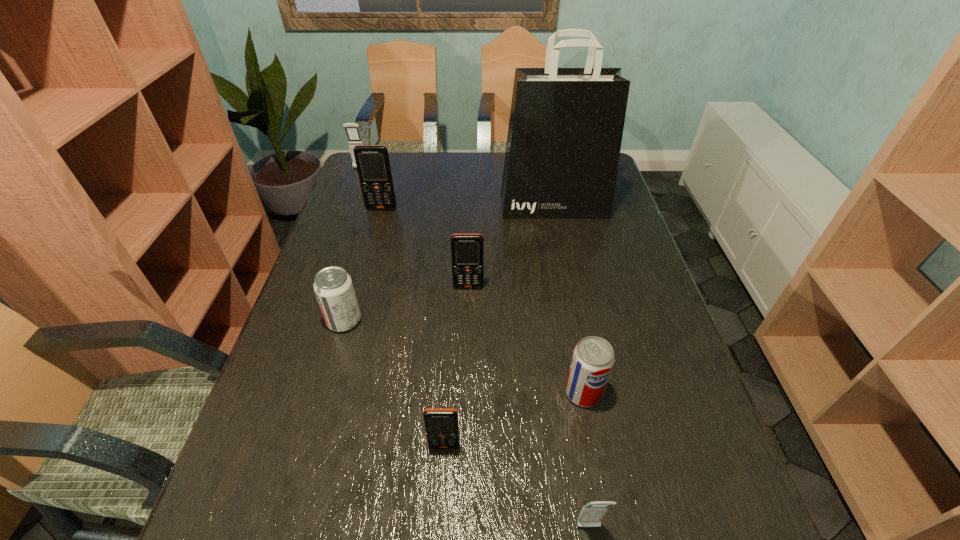
Where is `unoccupied area between the farther soda can and the nearer soda can`? The image size is (960, 540). unoccupied area between the farther soda can and the nearer soda can is located at coordinates tap(464, 356).

Locate an element on the screen. unoccupied position between the leftmost object and the left soda can is located at coordinates (352, 245).

Where is `free point between the seventh shortest object and the smallest orange cellular telephone`? The width and height of the screenshot is (960, 540). free point between the seventh shortest object and the smallest orange cellular telephone is located at coordinates (413, 327).

Locate an element on the screen. This screenshot has height=540, width=960. free space between the tallest object and the second farthest orange cellular telephone is located at coordinates (511, 246).

The width and height of the screenshot is (960, 540). I want to click on free spot between the nearer soda can and the leftmost orange cellular telephone, so coord(483,301).

Identify the location of empty space between the second smallest orange cellular telephone and the shopping bag. The width and height of the screenshot is (960, 540). (511, 246).

Where is `free spot between the fourth farthest object and the gray shopping bag`? free spot between the fourth farthest object and the gray shopping bag is located at coordinates (511, 246).

In order to click on blank region between the third nearest object and the fourth nearest object in this screenshot , I will do `click(464, 356)`.

The image size is (960, 540). Find the location of `object identified as the sixth closest to the right soda can`. object identified as the sixth closest to the right soda can is located at coordinates (373, 165).

The width and height of the screenshot is (960, 540). I want to click on object identified as the sixth closest to the nearer soda can, so click(x=373, y=165).